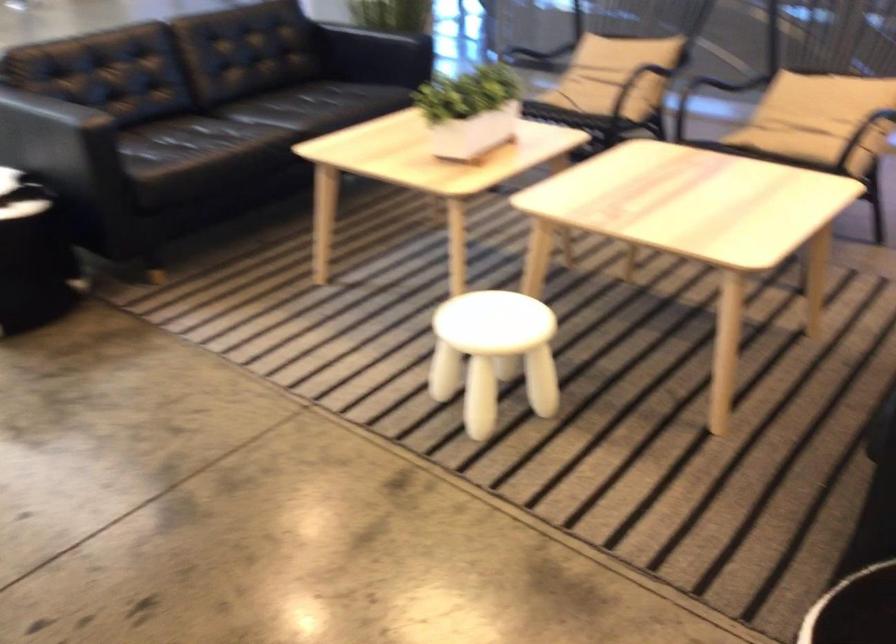
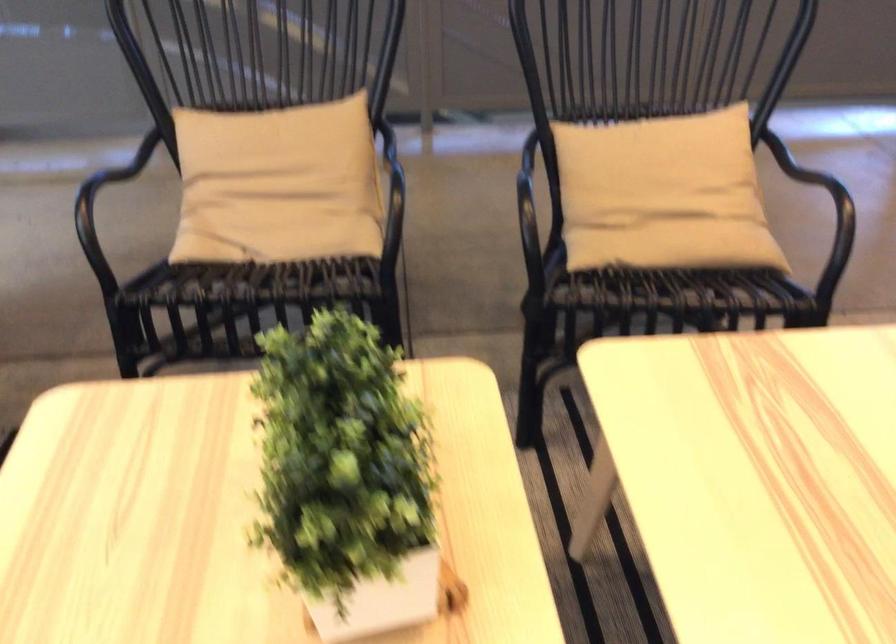
Find the pixel in the second image that matches pixel 800 105 in the first image.

(662, 194)